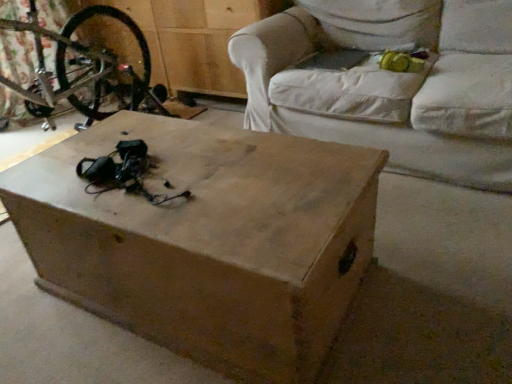
Question: From a real-world perspective, is white fabric couch at center under brown matte wooden box at center?

Choices:
 (A) no
 (B) yes

Answer: (A)

Question: Can you confirm if white fabric couch at center is bigger than brown matte wooden box at center?

Choices:
 (A) no
 (B) yes

Answer: (B)

Question: Can you confirm if white fabric couch at center is shorter than brown matte wooden box at center?

Choices:
 (A) no
 (B) yes

Answer: (A)

Question: Is white fabric couch at center closer to camera compared to brown matte wooden box at center?

Choices:
 (A) yes
 (B) no

Answer: (B)

Question: Does white fabric couch at center have a greater height compared to brown matte wooden box at center?

Choices:
 (A) yes
 (B) no

Answer: (A)

Question: Considering the relative positions of white fabric couch at center and brown matte wooden box at center in the image provided, is white fabric couch at center to the left of brown matte wooden box at center from the viewer's perspective?

Choices:
 (A) no
 (B) yes

Answer: (A)

Question: From the image's perspective, is brown matte wooden box at center below white fabric couch at center?

Choices:
 (A) no
 (B) yes

Answer: (B)

Question: Is the surface of brown matte wooden box at center in direct contact with white fabric couch at center?

Choices:
 (A) yes
 (B) no

Answer: (B)

Question: From a real-world perspective, is brown matte wooden box at center physically below white fabric couch at center?

Choices:
 (A) yes
 (B) no

Answer: (A)

Question: Considering the relative sizes of brown matte wooden box at center and white fabric couch at center in the image provided, is brown matte wooden box at center bigger than white fabric couch at center?

Choices:
 (A) no
 (B) yes

Answer: (A)

Question: Is brown matte wooden box at center further to camera compared to white fabric couch at center?

Choices:
 (A) yes
 (B) no

Answer: (B)

Question: Can you confirm if brown matte wooden box at center is taller than white fabric couch at center?

Choices:
 (A) no
 (B) yes

Answer: (A)

Question: Which is correct: white fabric couch at center is inside brown matte wooden box at center, or outside of it?

Choices:
 (A) outside
 (B) inside

Answer: (A)